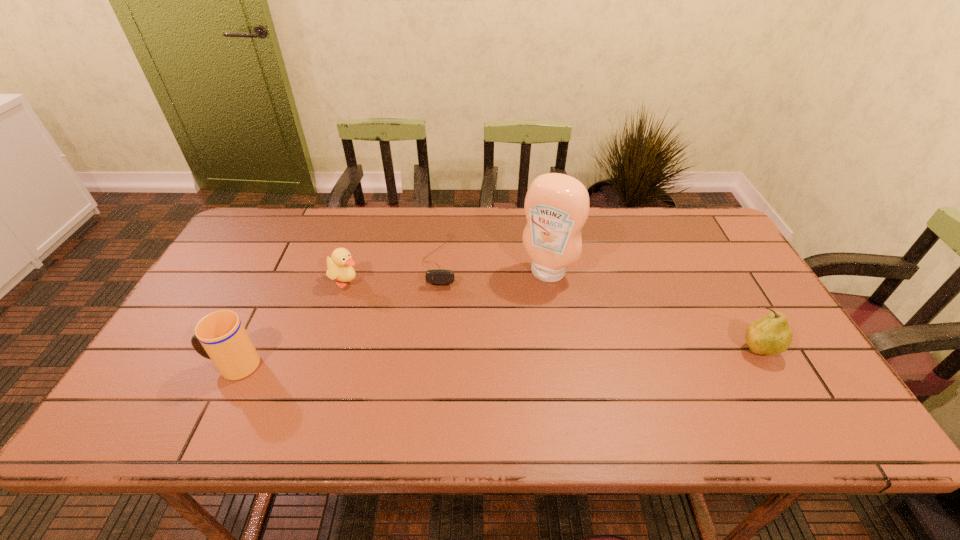
At what (x,y) coordinates should I click in order to perform the action: click on the leftmost object. Please return your answer as a coordinate pair (x, y). Looking at the image, I should click on (220, 336).

Identify the location of pear. (771, 334).

You are a GUI agent. You are given a task and a screenshot of the screen. Output one action in this format:
    pyautogui.click(x=<x>, y=<y>)
    Task: Click on the second object from right to left
    This screenshot has width=960, height=540.
    Given the screenshot: What is the action you would take?
    pyautogui.click(x=556, y=205)

In order to click on condiment in this screenshot , I will do `click(556, 205)`.

Find the location of a particular element. This screenshot has width=960, height=540. webcam is located at coordinates (438, 276).

Where is `the third object from right to left`? the third object from right to left is located at coordinates (438, 276).

Locate an element on the screen. duckling is located at coordinates (339, 267).

I want to click on vacant space situated on the side of the leftmost object with the handle, so click(x=156, y=366).

I want to click on vacant space located on the side of the leftmost object with the handle, so click(165, 366).

The width and height of the screenshot is (960, 540). Find the location of `vacant region located on the side of the leftmost object with the handle`. vacant region located on the side of the leftmost object with the handle is located at coordinates (181, 366).